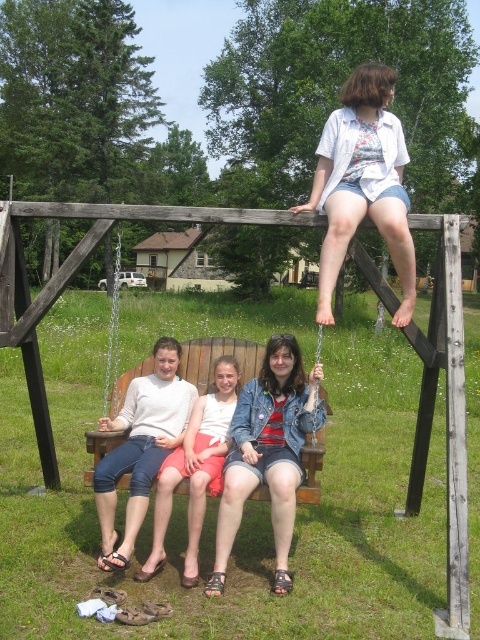
Question: Observing the image, what is the correct spatial positioning of white floral shirt at upper center in reference to denim shorts at center?

Choices:
 (A) above
 (B) below

Answer: (A)

Question: Observing the image, what is the correct spatial positioning of matte white sweater at center in reference to white floral shirt at upper center?

Choices:
 (A) left
 (B) right

Answer: (A)

Question: Which object is positioned farthest from the matte white sweater at center?

Choices:
 (A) denim shorts at lower left
 (B) denim shorts at center
 (C) white floral shirt at upper center

Answer: (C)

Question: Which object is farther from the camera taking this photo?

Choices:
 (A) denim shorts at lower left
 (B) white floral shirt at upper center
 (C) matte white sweater at center
 (D) denim shorts at center

Answer: (D)

Question: Among these points, which one is nearest to the camera?

Choices:
 (A) (192, 436)
 (B) (223, 364)
 (C) (168, 384)

Answer: (A)

Question: Does denim shorts at lower left lie in front of denim shorts at center?

Choices:
 (A) yes
 (B) no

Answer: (A)